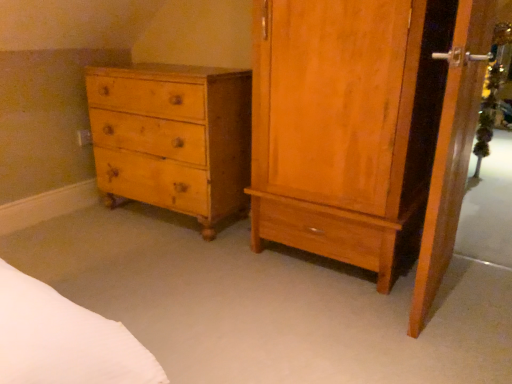
The image size is (512, 384). I want to click on free spot in front of yellow wood chest of drawers at left, so click(152, 267).